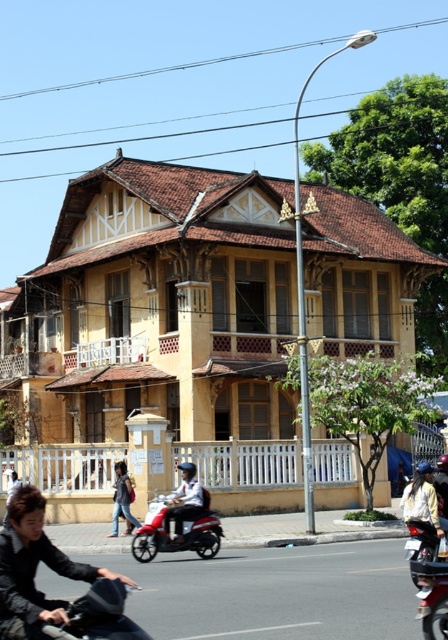
Is matte black motorcycle at lower left positioned before light brown leather jacket at lower center?

Yes, matte black motorcycle at lower left is in front of light brown leather jacket at lower center.

The height and width of the screenshot is (640, 448). Identify the location of matte black motorcycle at lower left. (34, 572).

Where is `matte black motorcycle at lower left`? This screenshot has height=640, width=448. matte black motorcycle at lower left is located at coordinates (34, 572).

Is metallic red motorcycle at lower right smaller than light brown leather jacket at lower center?

No.

Is point (443, 621) closer to viewer compared to point (120, 467)?

That is True.

The width and height of the screenshot is (448, 640). What are the coordinates of `metallic red motorcycle at lower right` in the screenshot? It's located at (427, 577).

Is matte black motorcycle at lower left positioned in front of metallic red motorcycle at lower right?

Yes, it is.

Is matte black motorcycle at lower left positioned behind metallic red motorcycle at lower right?

That is False.

In order to click on matte black motorcycle at lower left in this screenshot , I will do `click(34, 572)`.

Where is `matte black motorcycle at lower left`? The image size is (448, 640). matte black motorcycle at lower left is located at coordinates (34, 572).